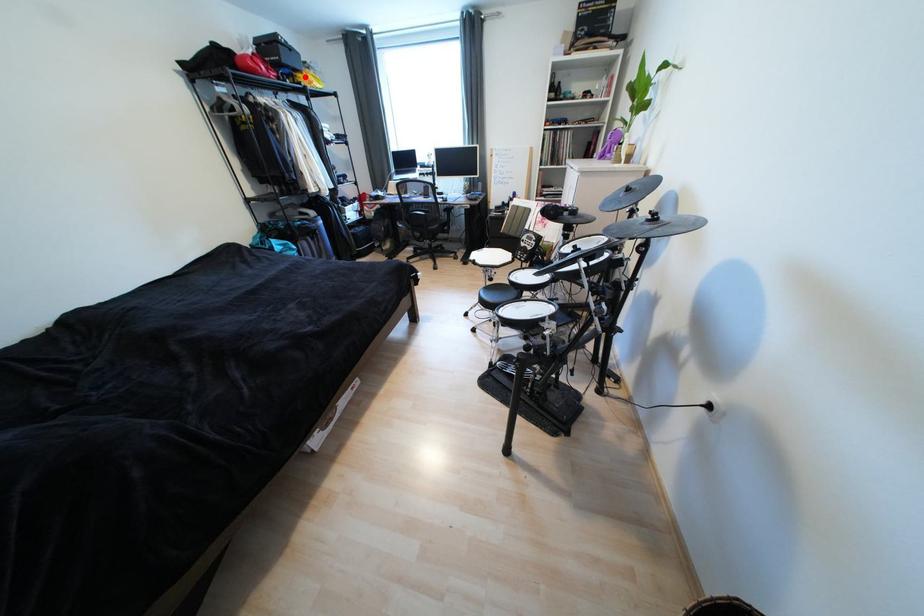
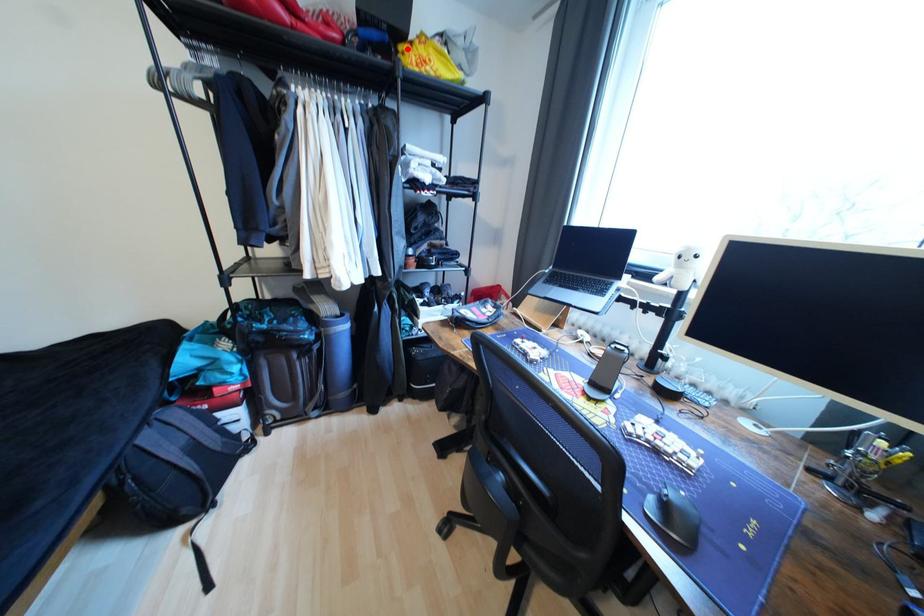
I am providing you with two images of the same scene from different viewpoints. A red point is marked on the first image and another point is marked on the second image. Do the highlighted points in image1 and image2 indicate the same real-world spot?

Yes